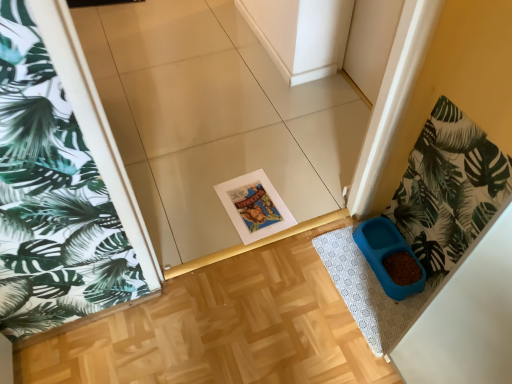
Where is `free space in front of blue plastic pet food bowl at lower right`? This screenshot has height=384, width=512. free space in front of blue plastic pet food bowl at lower right is located at coordinates (379, 309).